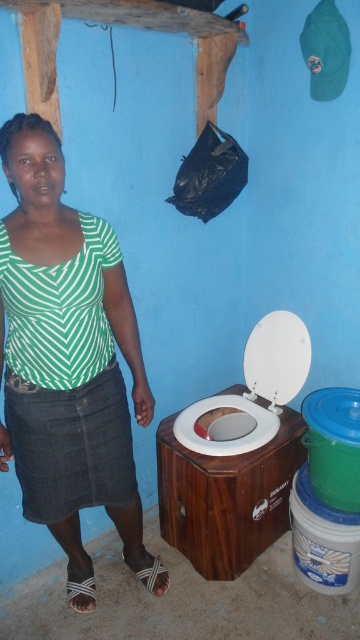
Who is more forward, [90,589] or [236,445]?

Point [236,445]

Between green striped shirt at upper left and white plastic toilet bowl at center, which one has more height?

green striped shirt at upper left is taller.

Who is more forward, (45, 492) or (267, 433)?

Point (45, 492) is more forward.

Where is `green striped shirt at upper left`? green striped shirt at upper left is located at coordinates [x=68, y=362].